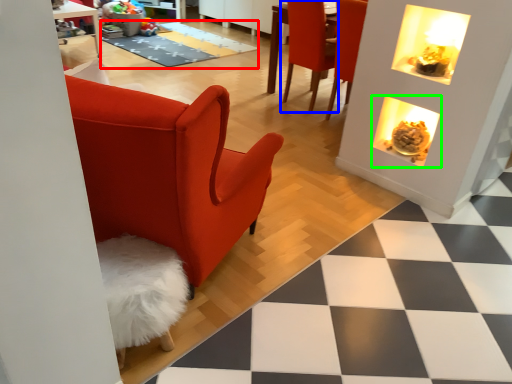
Question: Which is farther away from mat (highlighted by a red box)? chair (highlighted by a blue box) or fireplace (highlighted by a green box)?

Choices:
 (A) chair
 (B) fireplace

Answer: (B)